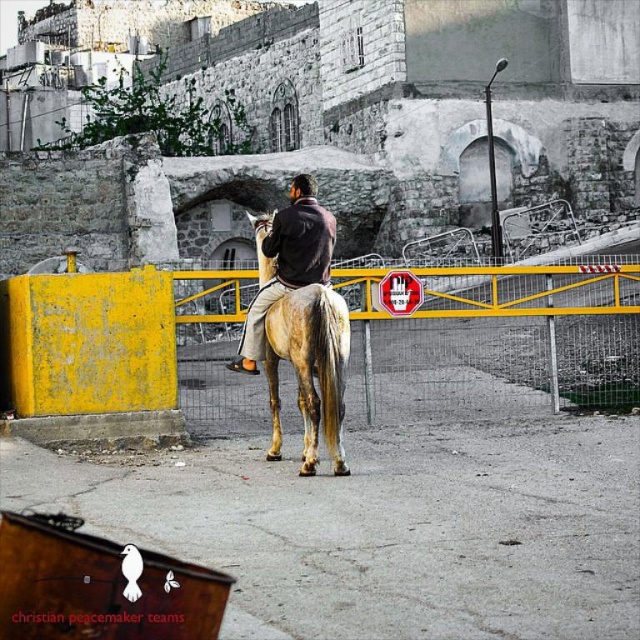
Which is below, golden-brown horse at center or dark brown leather jacket at center?

golden-brown horse at center is lower down.

Is point (339, 426) less distant than point (310, 211)?

Yes.

Locate an element on the screen. This screenshot has height=640, width=640. golden-brown horse at center is located at coordinates (308, 368).

Looking at this image, who is more distant from viewer, [538,272] or [268,348]?

The point [538,272] is more distant.

Based on the photo, does yellow metal fence at center appear on the right side of golden-brown horse at center?

Yes, yellow metal fence at center is to the right of golden-brown horse at center.

Does point (394, 333) come farther from viewer compared to point (272, 268)?

That is True.

You are a GUI agent. You are given a task and a screenshot of the screen. Output one action in this format:
    pyautogui.click(x=<x>, y=<y>)
    Task: Click on the yellow metal fence at center
    The width and height of the screenshot is (640, 640).
    Given the screenshot: What is the action you would take?
    pyautogui.click(x=506, y=333)

Which is in front, point (508, 378) or point (307, 280)?

Positioned in front is point (307, 280).

Can you confirm if yellow metal fence at center is taller than dark brown leather jacket at center?

No, yellow metal fence at center is not taller than dark brown leather jacket at center.

Is point (573, 324) in front of point (301, 236)?

No, it is not.

This screenshot has height=640, width=640. Identify the location of yellow metal fence at center. (506, 333).